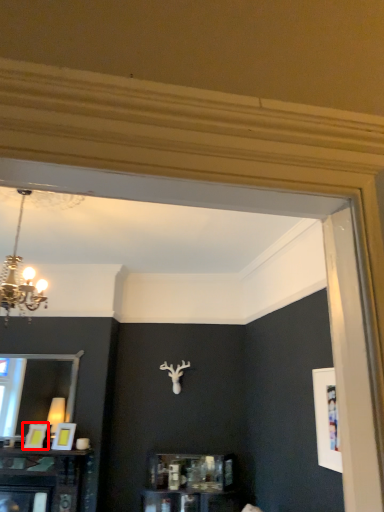
Question: From the image's perspective, what is the correct spatial relationship of picture frame (annotated by the red box) in relation to picture frame?

Choices:
 (A) below
 (B) above

Answer: (A)